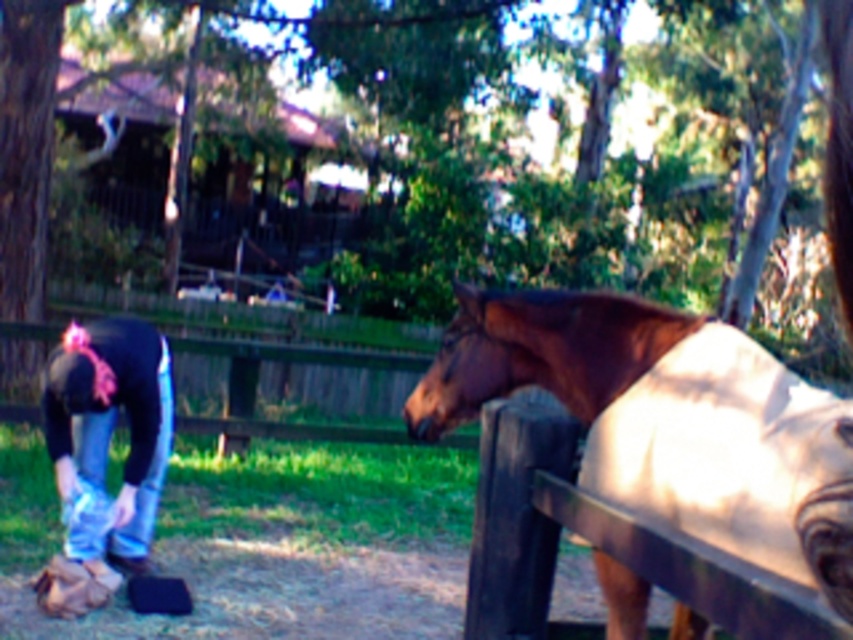
Is point (743, 396) behind point (103, 358)?

No, (743, 396) is in front of (103, 358).

Is brown glossy horse at right closer to camera compared to blue jeans at lower left?

That is True.

Is point (839, 572) in front of point (128, 548)?

That is True.

Find the location of a particular element. This screenshot has height=640, width=853. brown glossy horse at right is located at coordinates (548, 352).